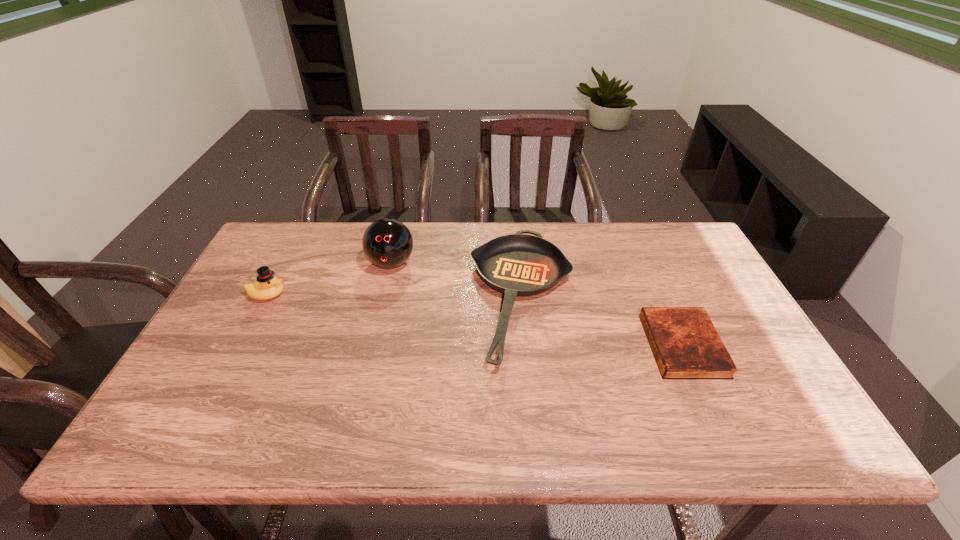
At what (x,y) coordinates should I click in order to perform the action: click on unoccupied position between the duck and the frying pan. Please return your answer as a coordinate pair (x, y). The height and width of the screenshot is (540, 960). Looking at the image, I should click on (395, 296).

Image resolution: width=960 pixels, height=540 pixels. In order to click on free space between the second shortest object and the Bible in this screenshot , I will do `click(603, 321)`.

Identify the location of unoccupied area between the frying pan and the bowling ball. (457, 280).

Find the location of a particular element. object that stands as the second closest to the Bible is located at coordinates (387, 243).

Image resolution: width=960 pixels, height=540 pixels. Find the location of `the closest object to the duck`. the closest object to the duck is located at coordinates (387, 243).

This screenshot has height=540, width=960. Find the location of `free space that satisfies the following two spatial constraints: 1. on the surface of the third tallest object near the finger holes; 2. on the left side of the tallest object`. free space that satisfies the following two spatial constraints: 1. on the surface of the third tallest object near the finger holes; 2. on the left side of the tallest object is located at coordinates (383, 297).

Image resolution: width=960 pixels, height=540 pixels. In order to click on vacant space that satisfies the following two spatial constraints: 1. on the surface of the frying pan near the finger holes; 2. on the right side of the bowling ball in this screenshot , I will do 383,297.

The width and height of the screenshot is (960, 540). Find the location of `free space that satisfies the following two spatial constraints: 1. on the back side of the third tallest object; 2. on the front-facing side of the duck`. free space that satisfies the following two spatial constraints: 1. on the back side of the third tallest object; 2. on the front-facing side of the duck is located at coordinates (522, 295).

Find the location of a particular element. vacant position in the image that satisfies the following two spatial constraints: 1. on the surface of the second object from left to right near the finger holes; 2. on the front-facing side of the second tallest object is located at coordinates (384, 295).

Where is `vacant space that satisfies the following two spatial constraints: 1. on the front-facing side of the second tallest object; 2. on the left side of the third tallest object`? vacant space that satisfies the following two spatial constraints: 1. on the front-facing side of the second tallest object; 2. on the left side of the third tallest object is located at coordinates (266, 297).